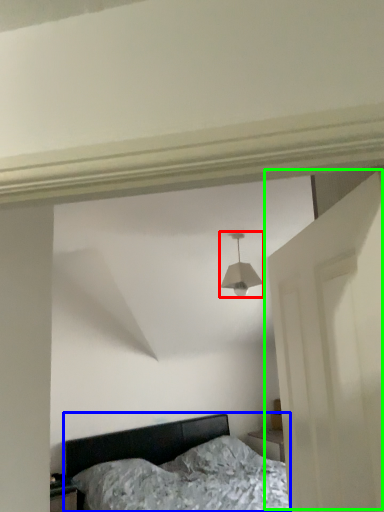
Question: Which is farther away from lamp (highlighted by a red box)? bed (highlighted by a blue box) or door (highlighted by a green box)?

Choices:
 (A) bed
 (B) door

Answer: (A)